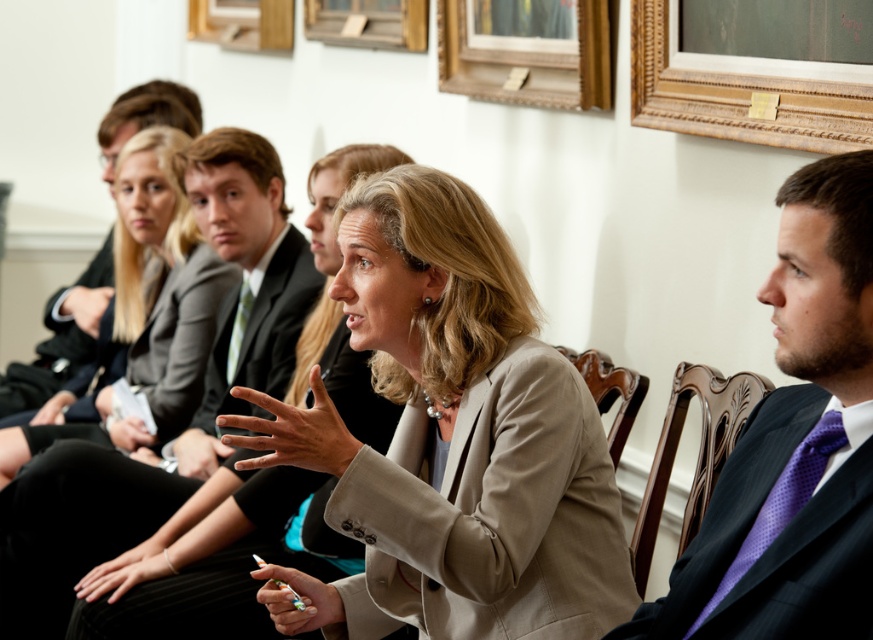
You are standing in the room and want to move from the point at coordinates point (468,577) to the point at coordinates point (45,579). Which direction should you move to get closer to the latter point?

To move from point (468,577) to point (45,579), you should move downward because point (45,579) is located below point (468,577).

You are standing in the conference room and want to move from the point at coordinates point [651,516] to the point at coordinates point [72,328]. Which direction should you move to get closer to your destination?

To move from point [651,516] to point [72,328], you should move downward and to the left since point [651,516] is in front of point [72,328].